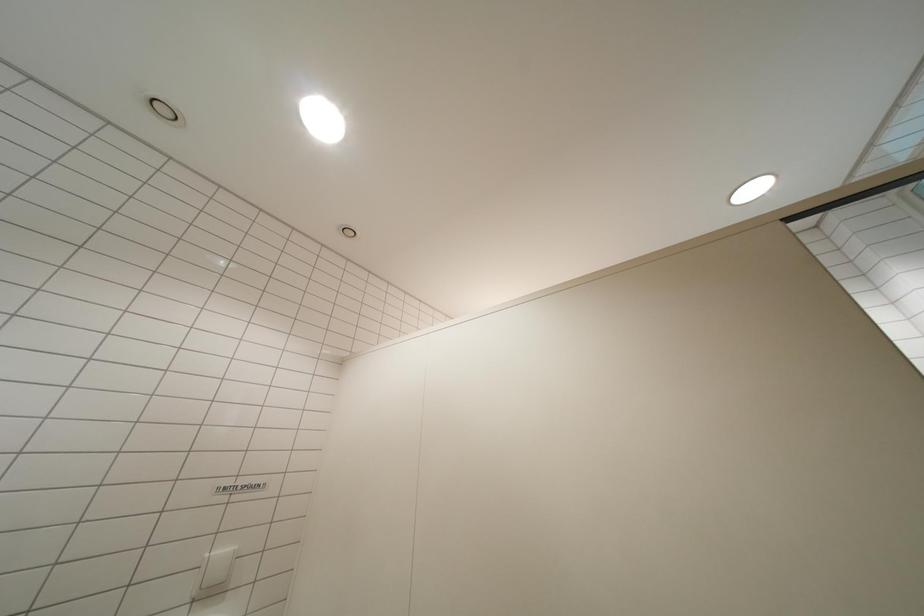
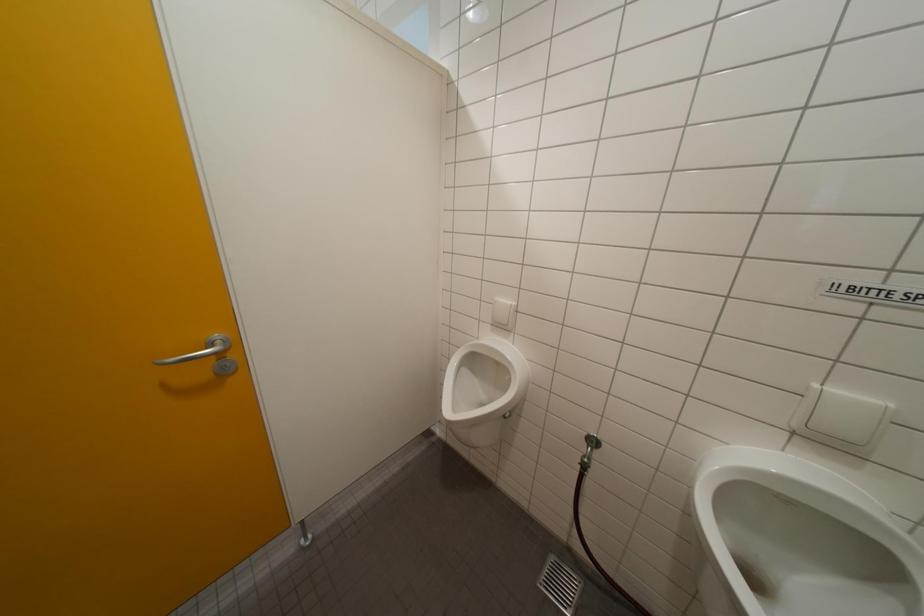
Question: Based on the continuous images, in which direction is the camera rotating? Reply with the corresponding letter.

Choices:
 (A) Left
 (B) Right
 (C) Up
 (D) Down

Answer: (A)